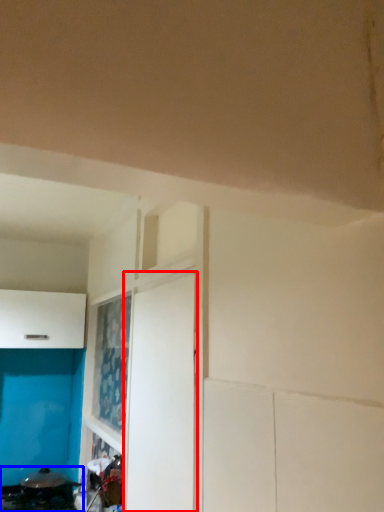
Question: Which object is further to the camera taking this photo, door (highlighted by a red box) or appliance (highlighted by a blue box)?

Choices:
 (A) door
 (B) appliance

Answer: (B)